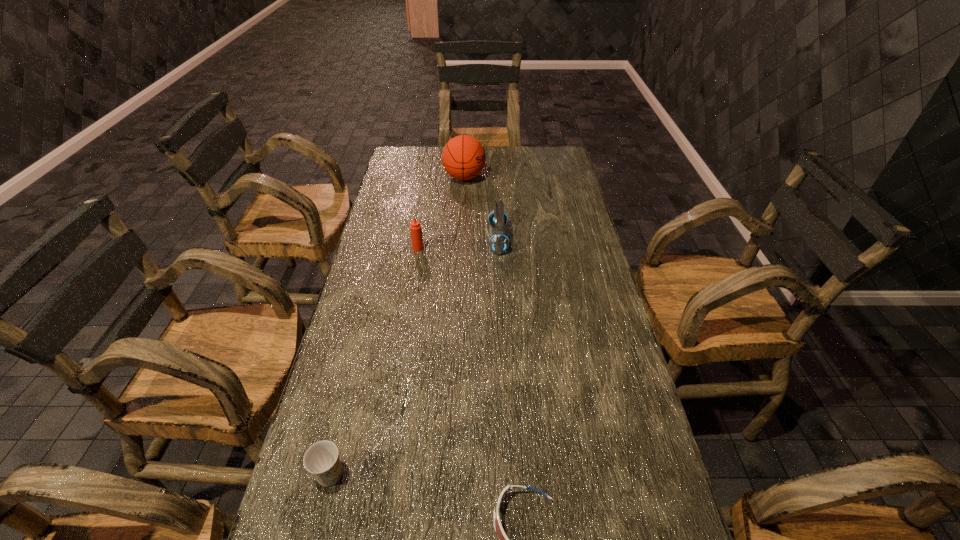
Where is `the tallest object`? This screenshot has width=960, height=540. the tallest object is located at coordinates (463, 157).

This screenshot has height=540, width=960. What are the coordinates of `basketball` in the screenshot? It's located at (x=463, y=157).

Find the location of `headset`. headset is located at coordinates (498, 243).

In order to click on the fourth object from right to left in this screenshot , I will do `click(415, 227)`.

Identify the location of the leftmost object. Image resolution: width=960 pixels, height=540 pixels. (322, 460).

At what (x,y) coordinates should I click in order to perform the action: click on Dixie cup. Please return your answer as a coordinate pair (x, y). Looking at the image, I should click on (322, 460).

Where is `vacant space located 0.360m on the side with logo of the third object from left to right`? The height and width of the screenshot is (540, 960). vacant space located 0.360m on the side with logo of the third object from left to right is located at coordinates (572, 178).

I want to click on vacant position located 0.080m on the ear cups of the headset, so click(466, 239).

The height and width of the screenshot is (540, 960). I want to click on free point located 0.200m on the ear cups of the headset, so click(x=431, y=239).

Find the location of a particular element. The height and width of the screenshot is (540, 960). vacant space located on the ear cups of the headset is located at coordinates tap(466, 239).